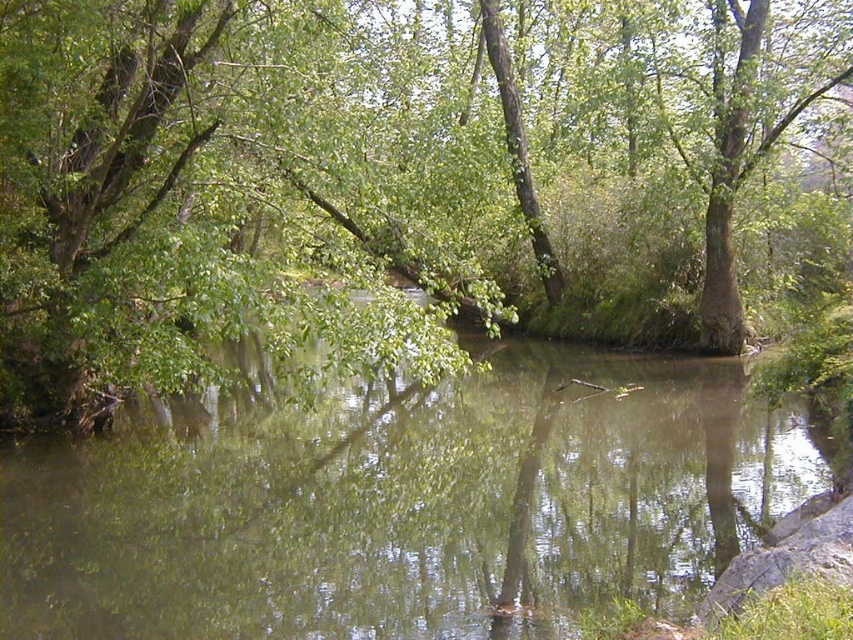
You are standing at the edge of the water and want to take a photo of the green leafy tree at center and the green reflective water at center. Which object will appear larger in the photo?

The green leafy tree at center will appear larger in the photo because it is much taller than the green reflective water at center.